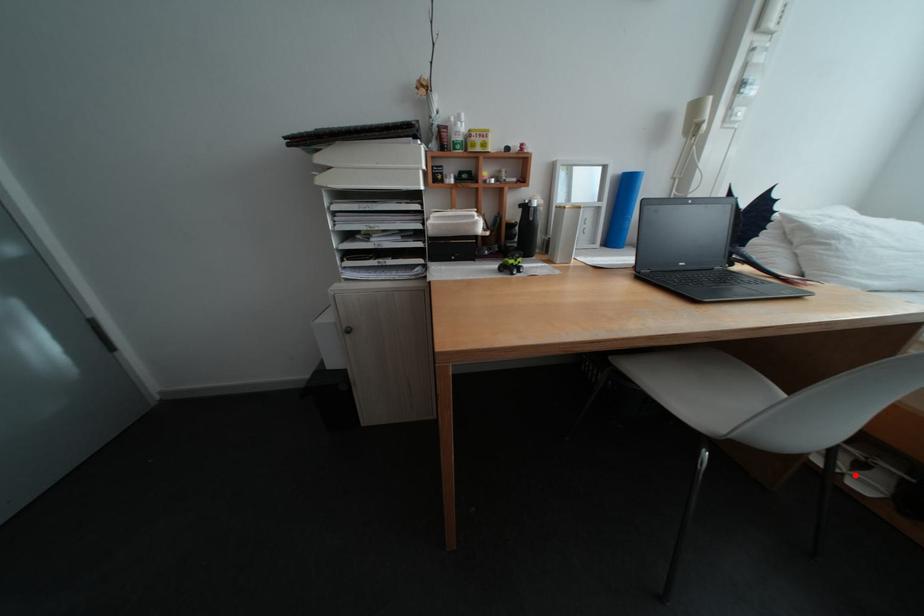
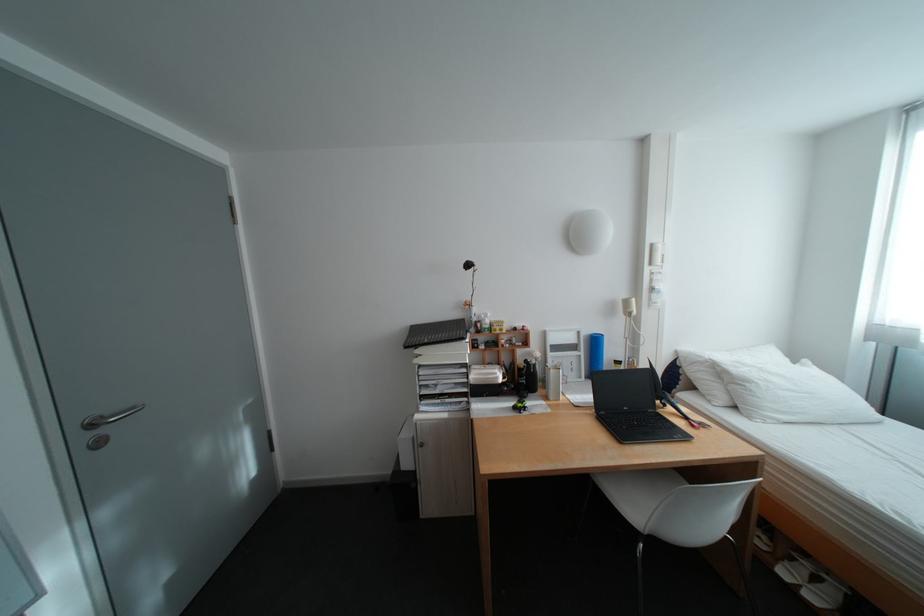
Question: I am providing you with two images of the same scene from different viewpoints. A red point is shown in image1. For the corresponding object point in image2, is it positioned nearer or farther from the camera?

Choices:
 (A) Nearer
 (B) Farther

Answer: (B)